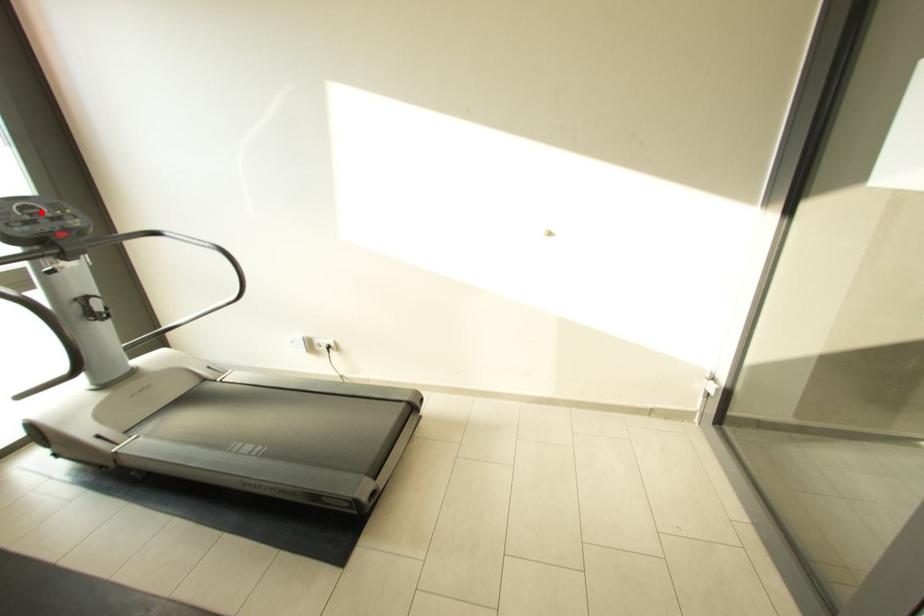
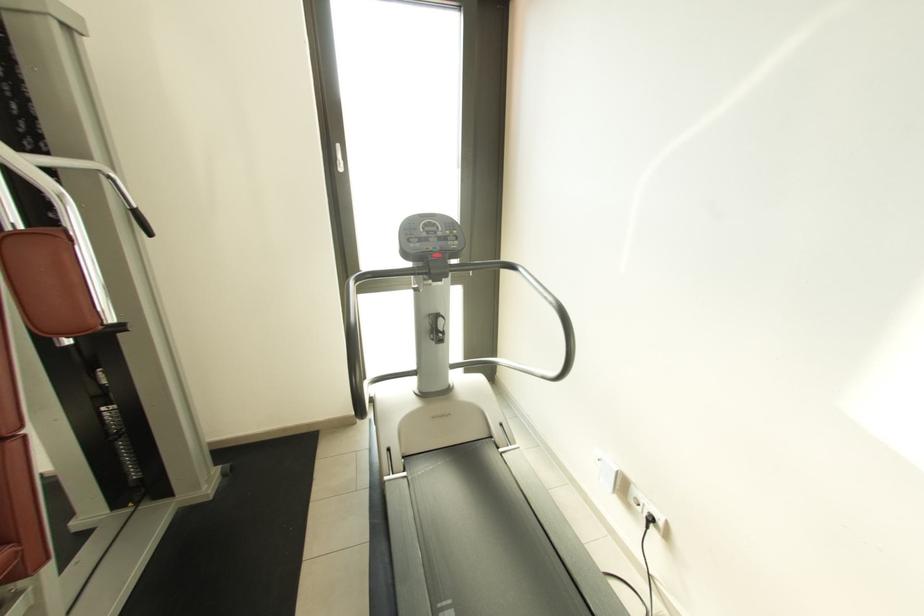
Question: I am providing you with two images of the same scene from different viewpoints. Image1 has a red point marked. In image2, the corresponding 3D location appears at what relative position? Reply with the corresponding letter.

Choices:
 (A) Closer
 (B) Farther

Answer: (A)